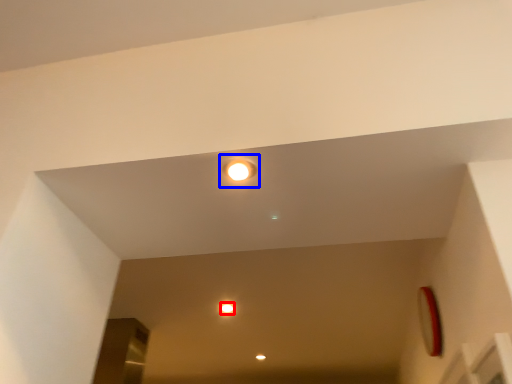
Question: Which point is further to the camera, dot (highlighted by a red box) or light (highlighted by a blue box)?

Choices:
 (A) dot
 (B) light

Answer: (A)